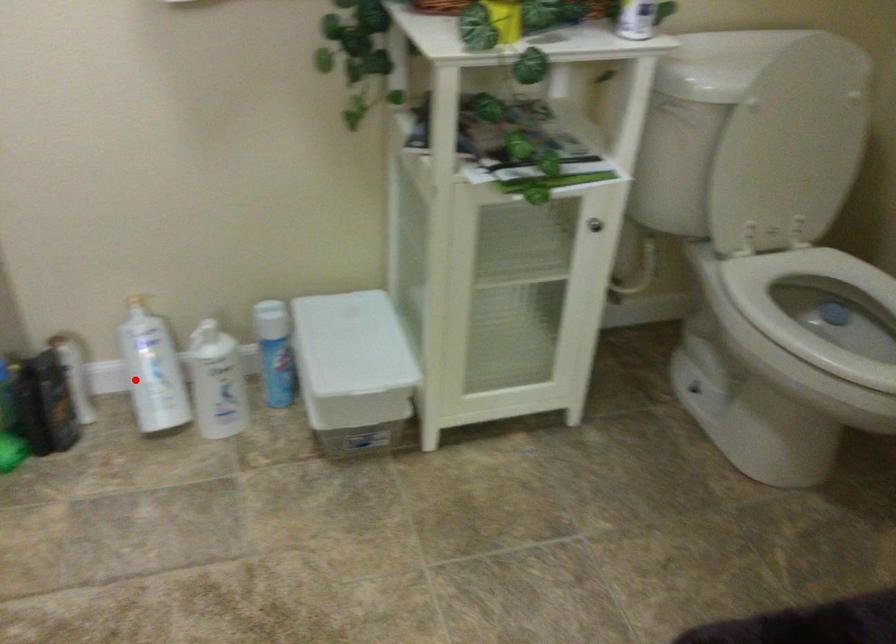
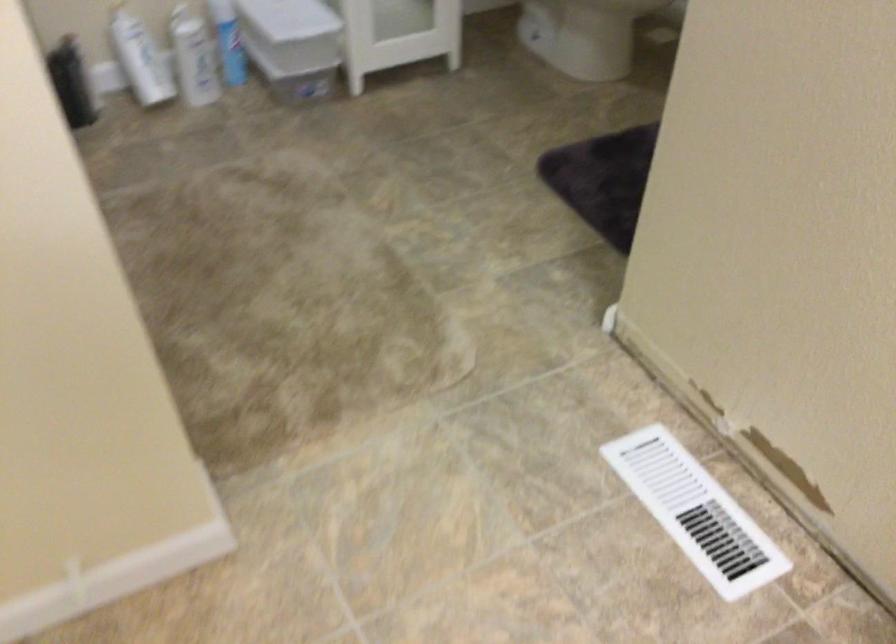
Locate, in the second image, the point that corresponds to the highlighted location in the first image.

(140, 59)